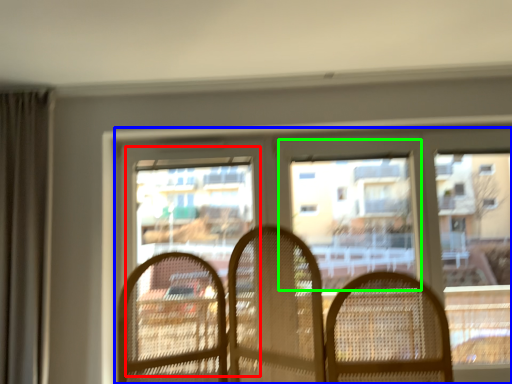
Question: Considering the real-world distances, which object is closest to screen door (highlighted by a red box)? window (highlighted by a blue box) or window screen (highlighted by a green box).

Choices:
 (A) window
 (B) window screen

Answer: (A)